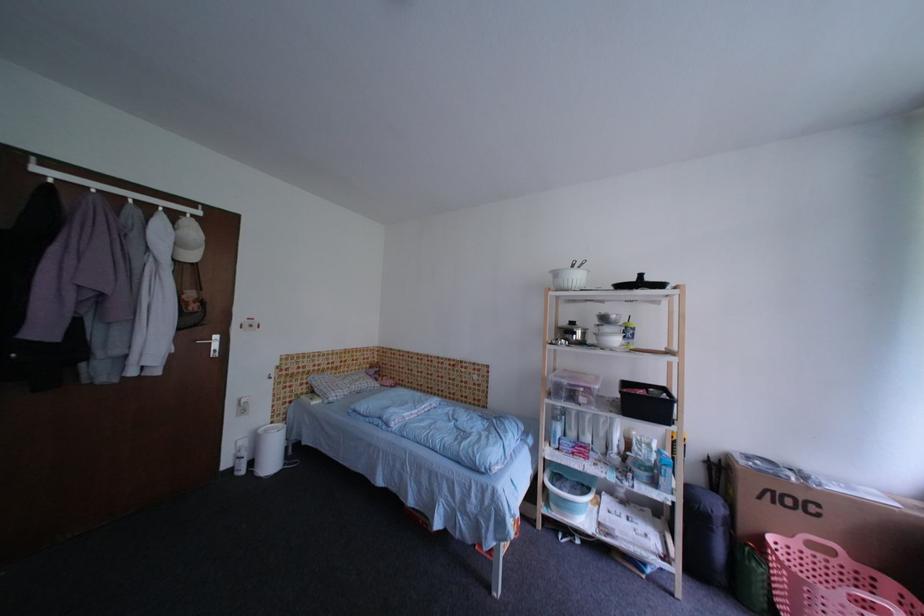
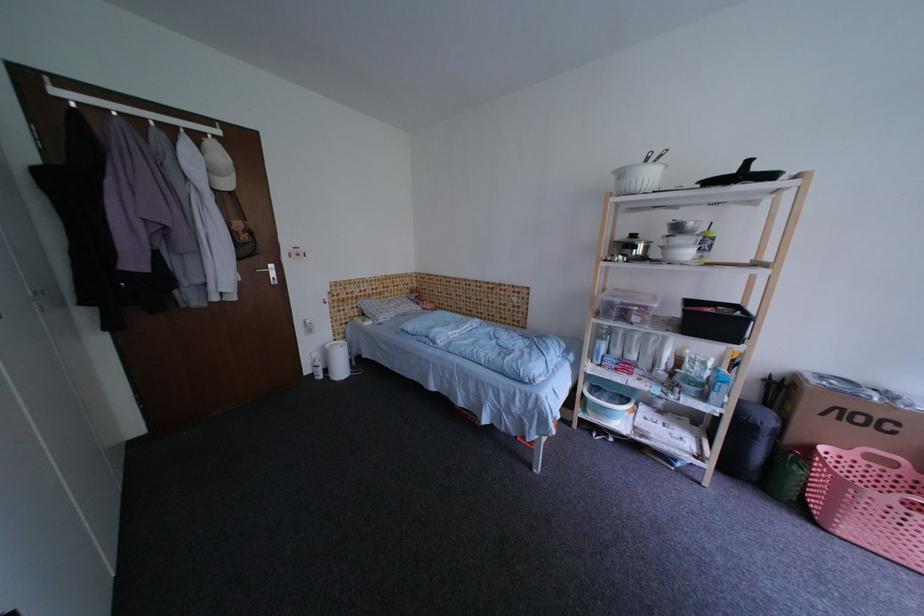
Locate, in the second image, the point that corresponds to pixel 720 533 in the first image.

(764, 440)